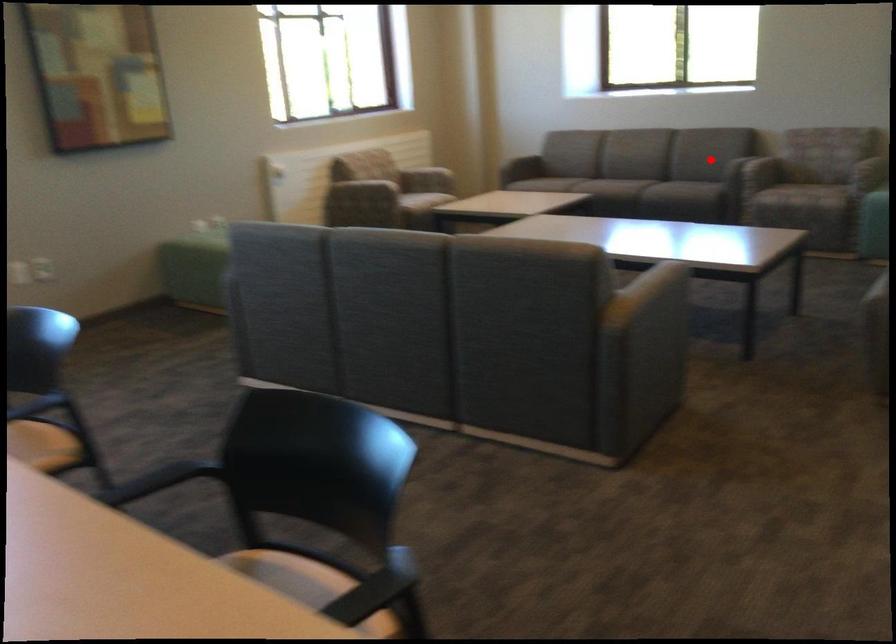
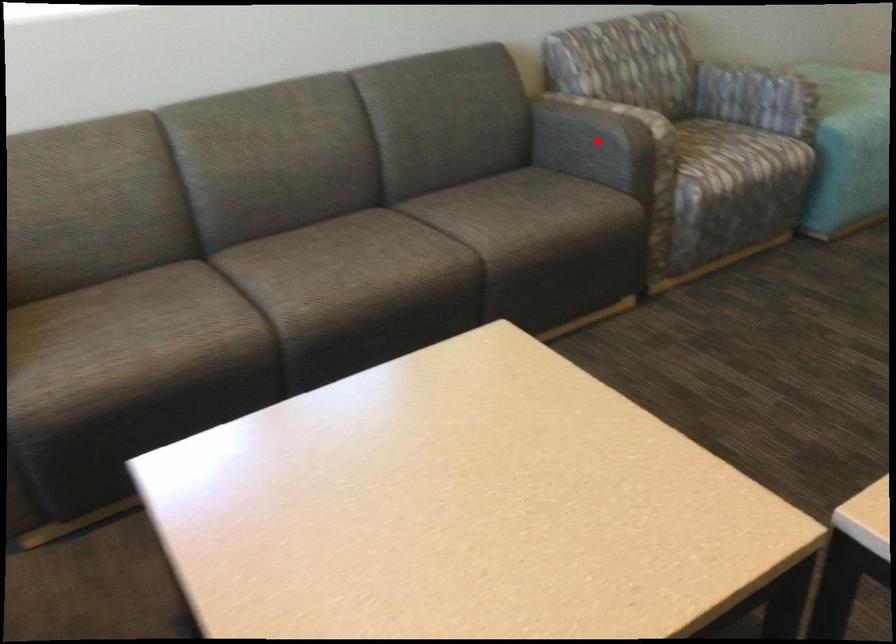
I am providing you with two images of the same scene from different viewpoints. A red point is marked on the first image and another point is marked on the second image. Does the point marked in image1 correspond to the same location as the one in image2?

Yes